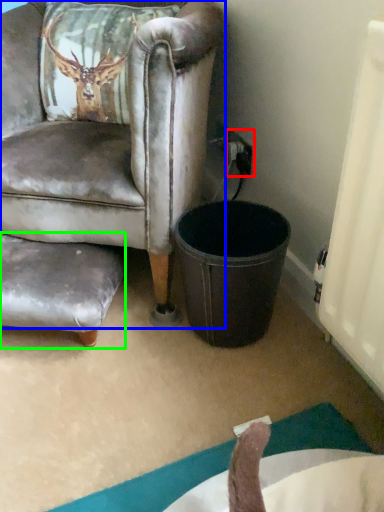
Question: Based on their relative distances, which object is nearer to power outlet (highlighted by a red box)? Choose from chair (highlighted by a blue box) and swivel chair (highlighted by a green box).

Choices:
 (A) chair
 (B) swivel chair

Answer: (A)